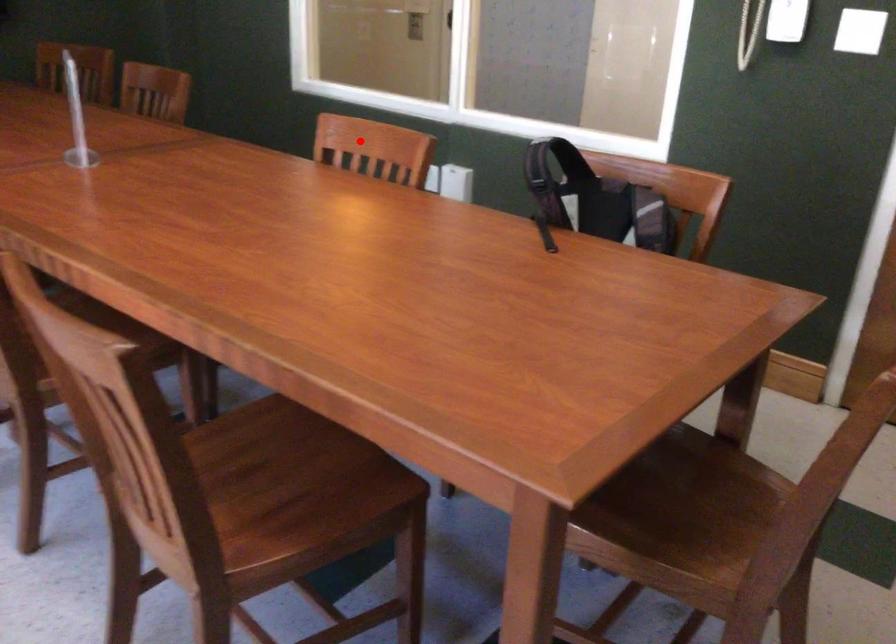
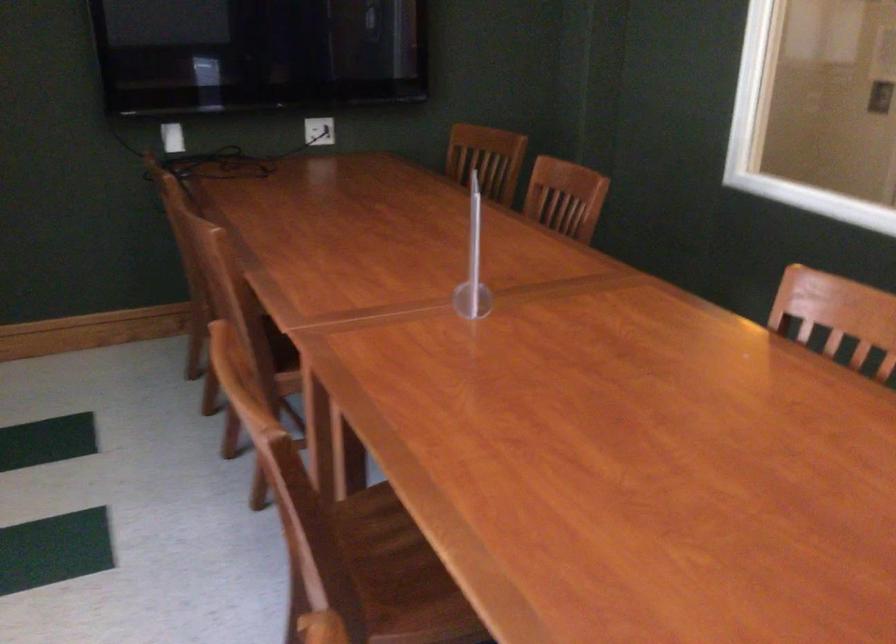
Where in the second image is the point corresponding to the highlighted location from the first image?

(841, 313)